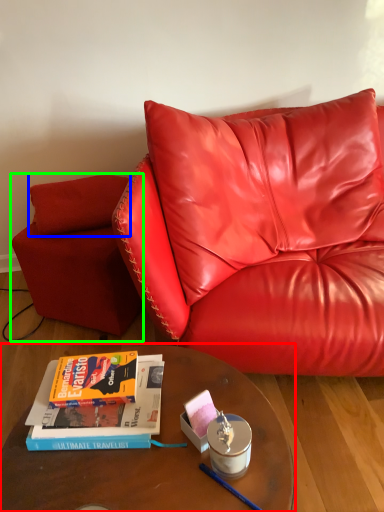
Question: Which object is the farthest from table (highlighted by a red box)? Choose among these: pillow (highlighted by a blue box) or armchair (highlighted by a green box).

Choices:
 (A) pillow
 (B) armchair

Answer: (A)